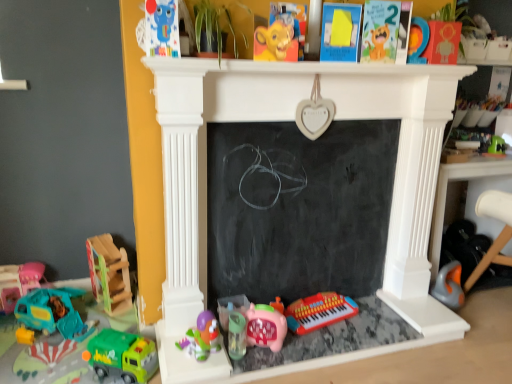
Where is `vacant area that lies to the right of orange plastic vacuum cleaner at lower right, the 1th toy viewed from the right`? The height and width of the screenshot is (384, 512). vacant area that lies to the right of orange plastic vacuum cleaner at lower right, the 1th toy viewed from the right is located at coordinates (488, 308).